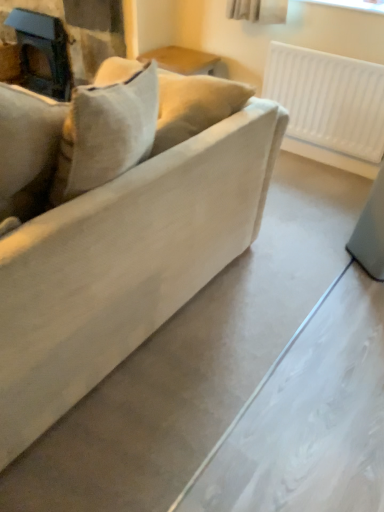
Question: Is the position of matte beige couch at center less distant than that of matte black fireplace at upper left?

Choices:
 (A) no
 (B) yes

Answer: (B)

Question: Is matte beige couch at center not within matte black fireplace at upper left?

Choices:
 (A) yes
 (B) no

Answer: (A)

Question: Can you confirm if matte beige couch at center is taller than matte black fireplace at upper left?

Choices:
 (A) no
 (B) yes

Answer: (B)

Question: Is matte beige couch at center aimed at matte black fireplace at upper left?

Choices:
 (A) no
 (B) yes

Answer: (A)

Question: Is matte beige couch at center positioned with its back to matte black fireplace at upper left?

Choices:
 (A) yes
 (B) no

Answer: (B)

Question: Considering the positions of matte black fireplace at upper left and matte beige couch at center in the image, is matte black fireplace at upper left wider or thinner than matte beige couch at center?

Choices:
 (A) wide
 (B) thin

Answer: (B)

Question: Considering the relative positions of matte black fireplace at upper left and matte beige couch at center in the image provided, is matte black fireplace at upper left to the left or to the right of matte beige couch at center?

Choices:
 (A) right
 (B) left

Answer: (B)

Question: Is matte black fireplace at upper left bigger or smaller than matte beige couch at center?

Choices:
 (A) small
 (B) big

Answer: (A)

Question: From the image's perspective, relative to matte beige couch at center, is matte black fireplace at upper left above or below?

Choices:
 (A) above
 (B) below

Answer: (A)

Question: Considering the positions of white plastic radiator at upper right and matte black fireplace at upper left in the image, is white plastic radiator at upper right taller or shorter than matte black fireplace at upper left?

Choices:
 (A) short
 (B) tall

Answer: (A)

Question: Do you think white plastic radiator at upper right is within matte black fireplace at upper left, or outside of it?

Choices:
 (A) inside
 (B) outside

Answer: (B)

Question: Considering the positions of white plastic radiator at upper right and matte black fireplace at upper left in the image, is white plastic radiator at upper right wider or thinner than matte black fireplace at upper left?

Choices:
 (A) wide
 (B) thin

Answer: (B)

Question: Relative to matte black fireplace at upper left, is white plastic radiator at upper right in front or behind?

Choices:
 (A) front
 (B) behind

Answer: (A)

Question: Considering the relative positions of matte beige couch at center and white plastic radiator at upper right in the image provided, is matte beige couch at center to the left or to the right of white plastic radiator at upper right?

Choices:
 (A) right
 (B) left

Answer: (B)

Question: Is matte beige couch at center situated inside white plastic radiator at upper right or outside?

Choices:
 (A) outside
 (B) inside

Answer: (A)